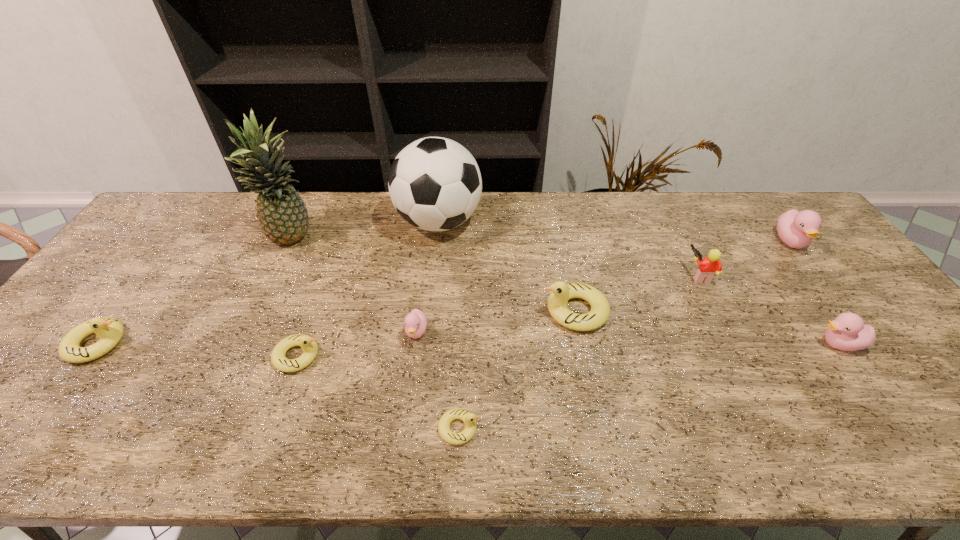
At what (x,y) coordinates should I click in order to perform the action: click on vacant space that is in between the smallest pink duckling and the biggest yellow duckling. Please return your answer as a coordinate pair (x, y). Looking at the image, I should click on (496, 321).

Locate an element on the screen. This screenshot has width=960, height=540. free space between the shortest duckling and the second biggest pink duckling is located at coordinates (649, 386).

The image size is (960, 540). In order to click on empty space that is in between the smallest pink duckling and the fourth duckling from left to right in this screenshot , I will do [x=438, y=380].

What are the coordinates of `vacant point located between the second yellow duckling from right to left and the second yellow duckling from left to right` in the screenshot? It's located at (378, 392).

I want to click on unoccupied area between the second smallest pink duckling and the farthest pink duckling, so click(815, 293).

Where is `the eighth closest object relative to the fifth duckling from right to left`? The width and height of the screenshot is (960, 540). the eighth closest object relative to the fifth duckling from right to left is located at coordinates (847, 332).

Locate which object ranks eighth in proximity to the ninth shortest object. Please provide its 2D coordinates. Your answer should be formatted as a tuple, i.e. [(x, y)], where the tuple contains the x and y coordinates of a point satisfying the conditions above.

[(847, 332)]

Select which duckling is the fifth closest to the pineapple. Please provide its 2D coordinates. Your answer should be formatted as a tuple, i.e. [(x, y)], where the tuple contains the x and y coordinates of a point satisfying the conditions above.

[(561, 292)]

Find the location of a particular element. the fourth closest duckling relative to the biggest yellow duckling is located at coordinates tap(309, 346).

Identify which pink duckling is the nearest to the second biggest pink duckling. Please provide its 2D coordinates. Your answer should be formatted as a tuple, i.e. [(x, y)], where the tuple contains the x and y coordinates of a point satisfying the conditions above.

[(796, 229)]